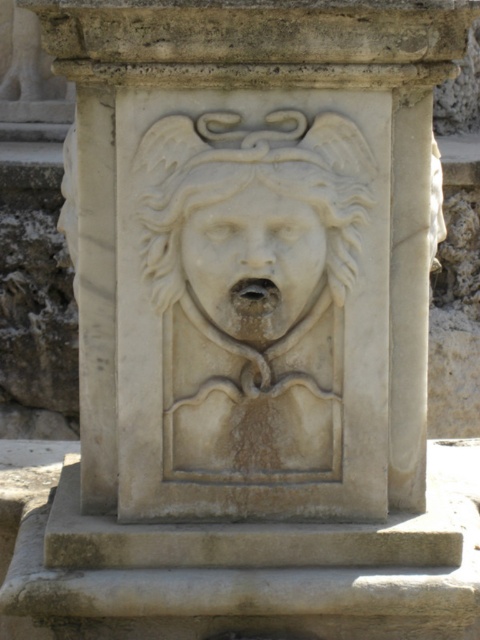
Between white marble lion at center and white marble face at center, which one appears on the right side from the viewer's perspective?

From the viewer's perspective, white marble lion at center appears more on the right side.

Which is in front, point (300, 172) or point (239, 220)?

Point (239, 220)

Who is more distant from viewer, (210, 253) or (188, 282)?

Positioned behind is point (188, 282).

This screenshot has height=640, width=480. I want to click on white marble lion at center, so click(x=252, y=237).